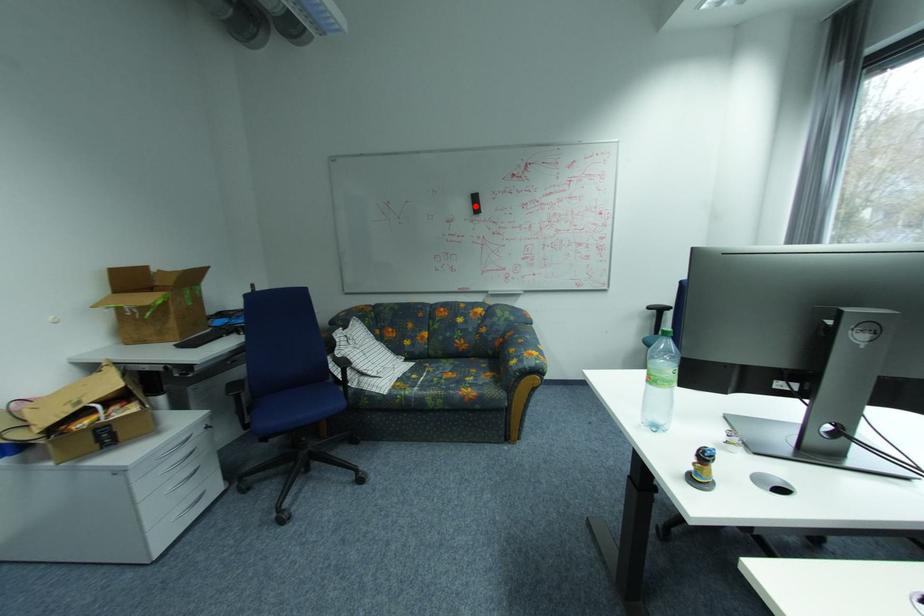
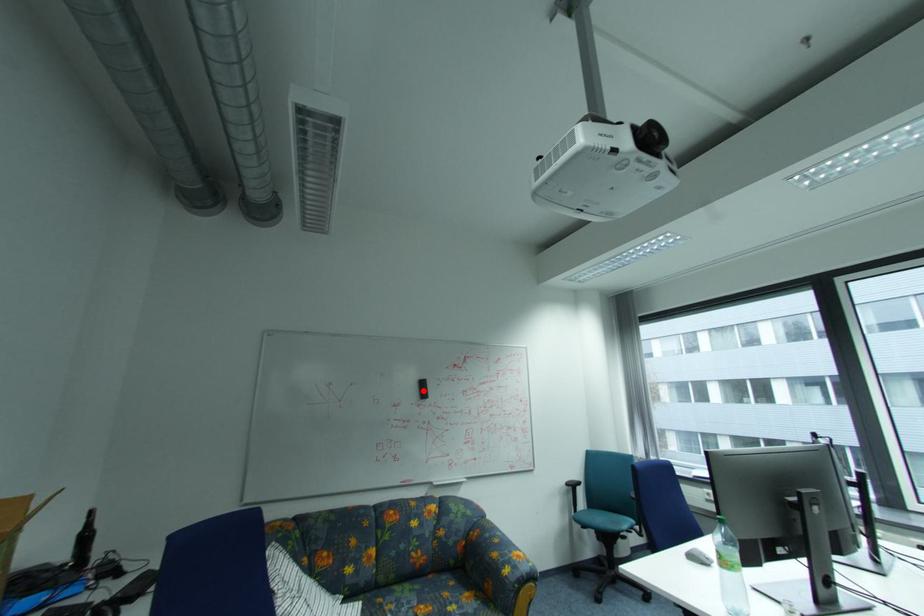
I am providing you with two images of the same scene from different viewpoints. A red point is marked on the first image and another point is marked on the second image. Are the points marked in image1 and image2 representing the same 3D position?

Yes